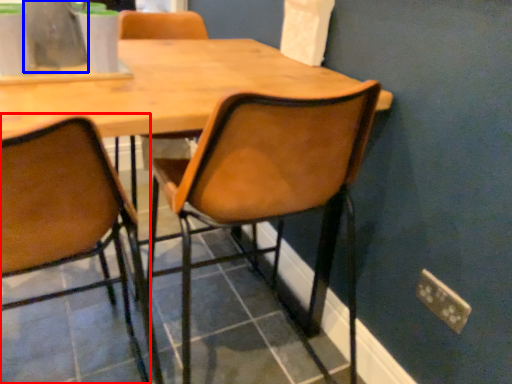
Question: Which object appears closest to the camera in this image, chair (highlighted by a red box) or vase (highlighted by a blue box)?

Choices:
 (A) chair
 (B) vase

Answer: (A)